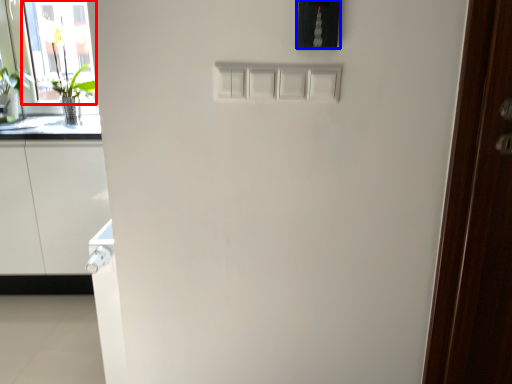
Question: Which point is closer to the camera, glass door (highlighted by a red box) or light switch (highlighted by a blue box)?

Choices:
 (A) glass door
 (B) light switch

Answer: (B)